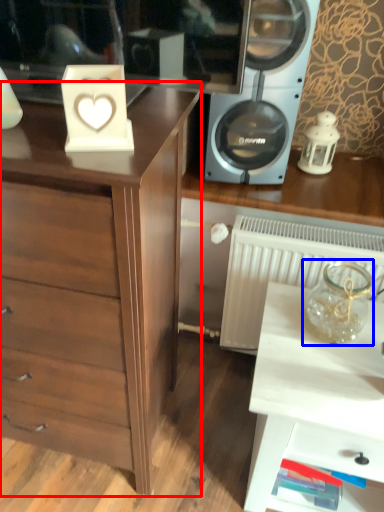
Question: Which object is further to the camera taking this photo, chest of drawers (highlighted by a red box) or glass vase (highlighted by a blue box)?

Choices:
 (A) chest of drawers
 (B) glass vase

Answer: (B)